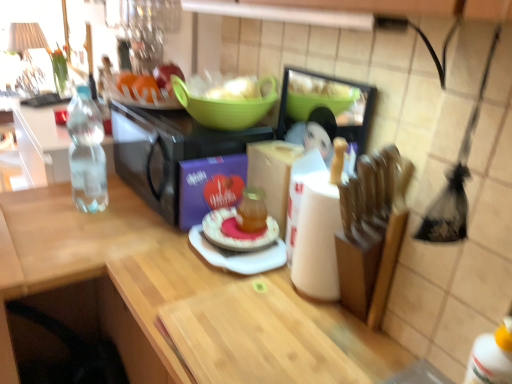
The height and width of the screenshot is (384, 512). I want to click on spots to the right of clear plastic bottle at left, so (x=139, y=218).